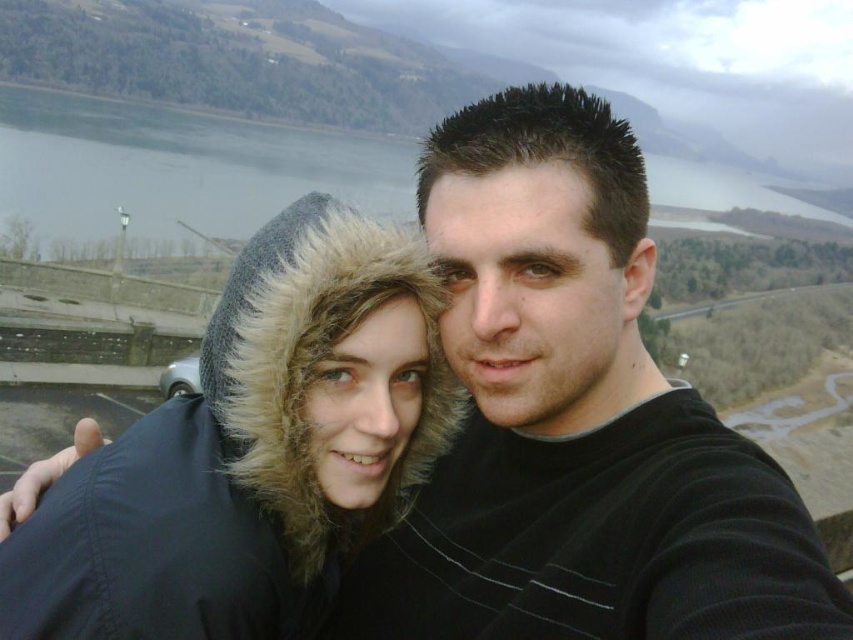
Which is more to the right, fuzzy fur hood at center or gray water at upper center?

gray water at upper center is more to the right.

Is fuzzy fur hood at center taller than gray water at upper center?

No, fuzzy fur hood at center is not taller than gray water at upper center.

Where is `fuzzy fur hood at center`? The width and height of the screenshot is (853, 640). fuzzy fur hood at center is located at coordinates (251, 451).

Between black matte shirt at center and fuzzy fur hood at center, which one is positioned higher?

Positioned higher is black matte shirt at center.

Describe the element at coordinates (575, 420) in the screenshot. I see `black matte shirt at center` at that location.

I want to click on black matte shirt at center, so click(575, 420).

Which of these two, black matte shirt at center or gray water at upper center, stands shorter?

With less height is black matte shirt at center.

Who is taller, black matte shirt at center or gray water at upper center?

Standing taller between the two is gray water at upper center.

Locate an element on the screen. The width and height of the screenshot is (853, 640). black matte shirt at center is located at coordinates (575, 420).